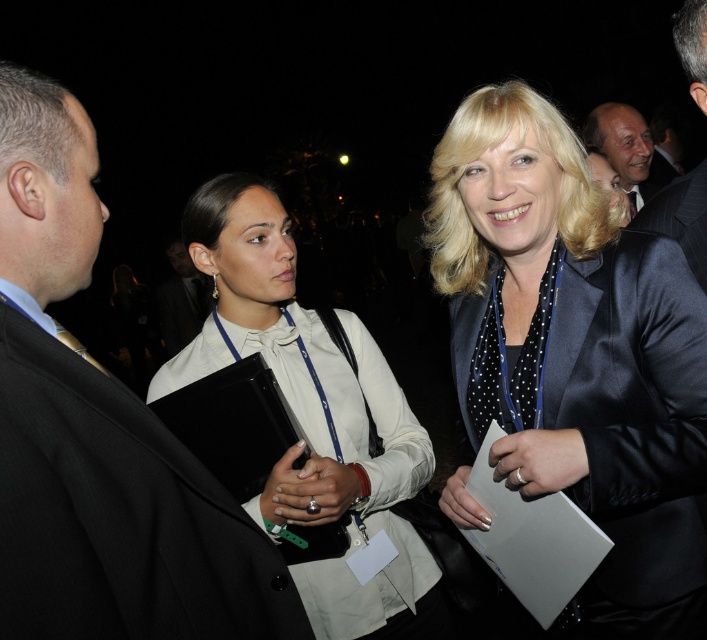
Question: Which point is farther from the camera taking this photo?

Choices:
 (A) (173, 340)
 (B) (682, 205)
 (C) (245, 198)
 (D) (474, 317)

Answer: (A)

Question: Which of these objects is positioned closest to the matte black suit at upper right?

Choices:
 (A) matte black suit at center
 (B) black suit at left
 (C) dark suit jacket at upper right
 (D) white satin blouse at center

Answer: (C)

Question: Which of the following is the farthest from the observer?

Choices:
 (A) black suit at left
 (B) matte black suit at upper right

Answer: (B)

Question: Is white satin blouse at center above dark suit jacket at upper right?

Choices:
 (A) yes
 (B) no

Answer: (B)

Question: Where is black satin suit at right located in relation to matte black suit at upper right in the image?

Choices:
 (A) below
 (B) above

Answer: (A)

Question: Does satin black jacket at center have a larger size compared to matte black suit at center?

Choices:
 (A) no
 (B) yes

Answer: (A)